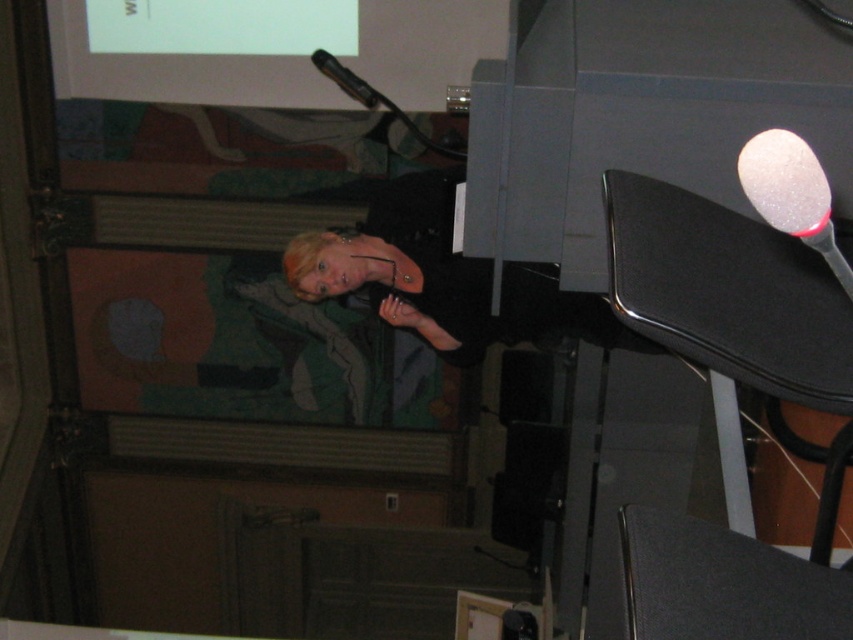
Who is lower down, sparkly white spoon at upper right or black plastic microphone at upper center?

sparkly white spoon at upper right

Is point (804, 200) positioned behind point (367, 92)?

No, it is in front of (367, 92).

The height and width of the screenshot is (640, 853). What do you see at coordinates (792, 193) in the screenshot?
I see `sparkly white spoon at upper right` at bounding box center [792, 193].

Image resolution: width=853 pixels, height=640 pixels. What are the coordinates of `sparkly white spoon at upper right` in the screenshot? It's located at (792, 193).

Between point (300, 289) and point (361, 92), which one is positioned in front?

Positioned in front is point (300, 289).

Who is more forward, (523,308) or (376,106)?

Point (523,308) is more forward.

Where is `matte black dress at center`? matte black dress at center is located at coordinates (444, 276).

Can you confirm if matte black dress at center is wider than sparkly white spoon at upper right?

Indeed, matte black dress at center has a greater width compared to sparkly white spoon at upper right.

Does matte black dress at center have a greater height compared to sparkly white spoon at upper right?

Yes, matte black dress at center is taller than sparkly white spoon at upper right.

Who is more forward, (334, 237) or (811, 196)?

Positioned in front is point (811, 196).

Find the location of a particular element. This screenshot has height=640, width=853. matte black dress at center is located at coordinates (444, 276).